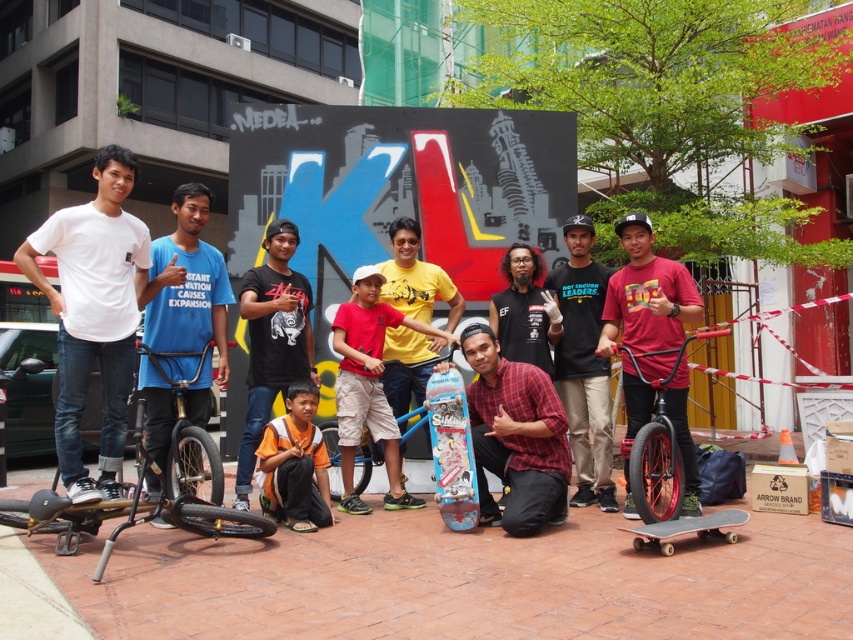
Question: Among these points, which one is farthest from the camera?

Choices:
 (A) (677, 424)
 (B) (100, 506)
 (C) (265, 468)

Answer: (A)

Question: Can you confirm if white matte skateboard at left is positioned above orange fabric shirt at center?

Choices:
 (A) no
 (B) yes

Answer: (B)

Question: Is white matte skateboard at left below matte yellow t-shirt at center?

Choices:
 (A) yes
 (B) no

Answer: (B)

Question: Which point is closer to the camera taking this photo?

Choices:
 (A) (397, 358)
 (B) (663, 548)
 (C) (181, 496)

Answer: (B)

Question: Which of the following is the farthest from the observer?

Choices:
 (A) (321, 429)
 (B) (491, 445)

Answer: (A)

Question: Is black matte shirt at center wider than wooden skateboard at center?

Choices:
 (A) no
 (B) yes

Answer: (A)